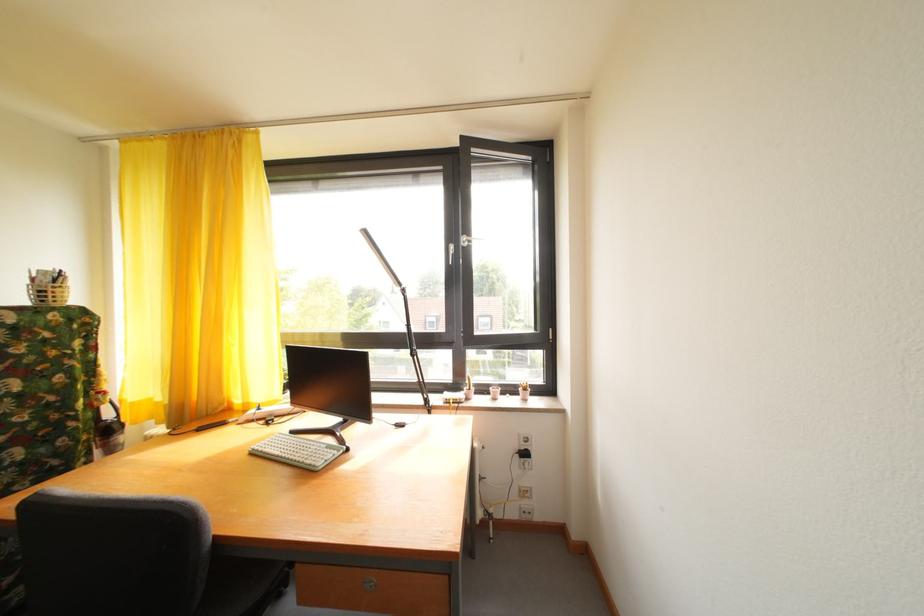
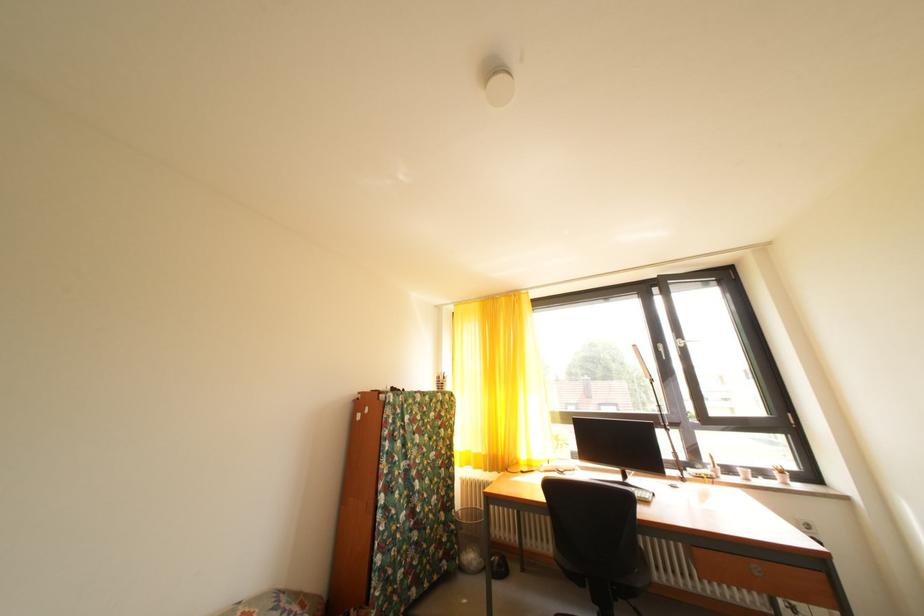
Which direction would the cameraman need to move to produce the second image?

The cameraman moved toward left, backward.